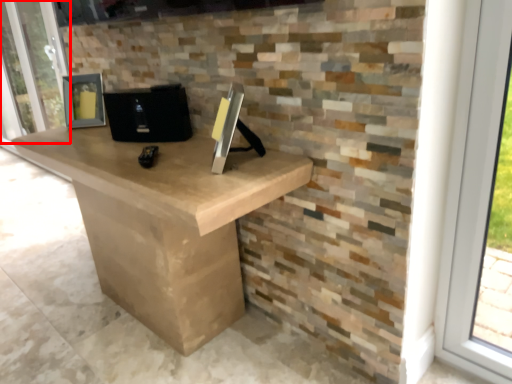
Question: Considering the relative positions of screen door (annotated by the red box) and computer in the image provided, where is screen door (annotated by the red box) located with respect to the staircase?

Choices:
 (A) right
 (B) left

Answer: (B)